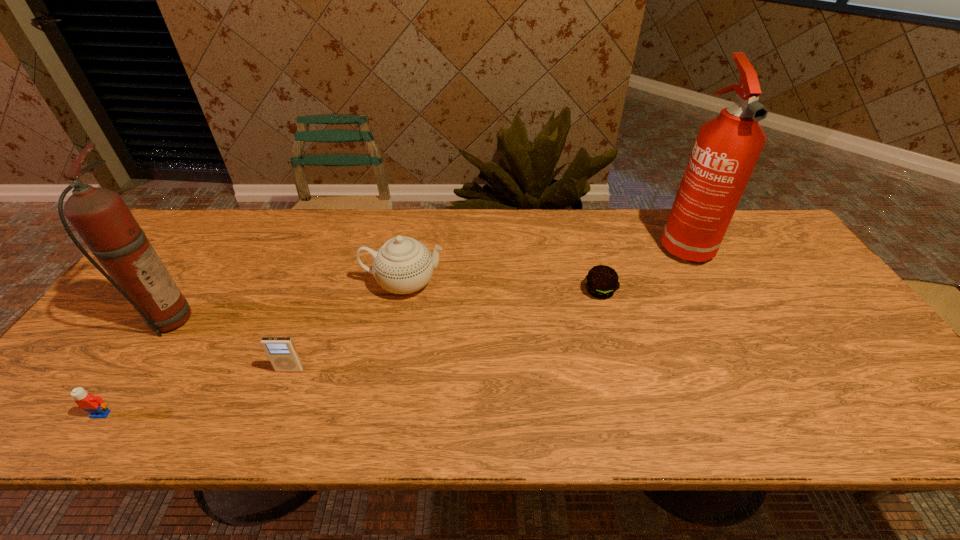
Where is `free area in between the shorter fire extinguisher and the fifth farthest object`? free area in between the shorter fire extinguisher and the fifth farthest object is located at coordinates (228, 345).

Image resolution: width=960 pixels, height=540 pixels. Identify the location of empty space between the third shortest object and the nearer fire extinguisher. (228, 345).

Where is `free spot between the right fire extinguisher and the fourth object from left to right`? free spot between the right fire extinguisher and the fourth object from left to right is located at coordinates (543, 262).

In order to click on empty location between the tallest object and the second nearest object in this screenshot , I will do `click(487, 306)`.

Locate an element on the screen. This screenshot has height=540, width=960. empty location between the third object from left to right and the rightmost object is located at coordinates (487, 306).

This screenshot has width=960, height=540. I want to click on empty space between the Lego and the chinaware, so click(252, 348).

The height and width of the screenshot is (540, 960). What are the coordinates of `free space between the farther fire extinguisher and the third object from right to left` in the screenshot? It's located at (543, 262).

Identify which object is located as the fifth nearest to the right fire extinguisher. Please provide its 2D coordinates. Your answer should be formatted as a tuple, i.e. [(x, y)], where the tuple contains the x and y coordinates of a point satisfying the conditions above.

[(94, 405)]

Locate which object is the third closest to the patty. Please provide its 2D coordinates. Your answer should be formatted as a tuple, i.e. [(x, y)], where the tuple contains the x and y coordinates of a point satisfying the conditions above.

[(281, 351)]

Image resolution: width=960 pixels, height=540 pixels. Find the location of `free region that satisfies the following two spatial constraints: 1. on the side of the left fire extinguisher with the label and nozzle; 2. on the face of the nearest object`. free region that satisfies the following two spatial constraints: 1. on the side of the left fire extinguisher with the label and nozzle; 2. on the face of the nearest object is located at coordinates (103, 414).